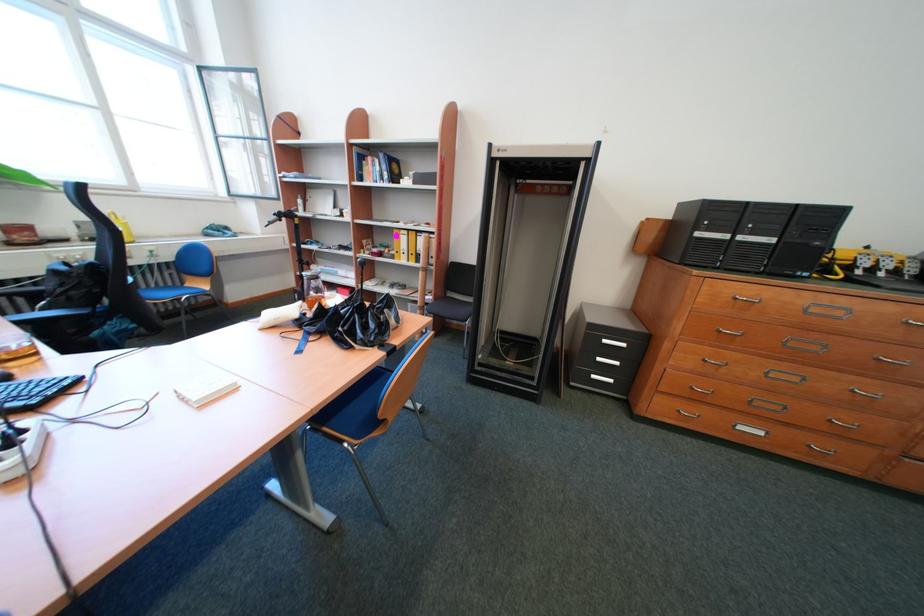
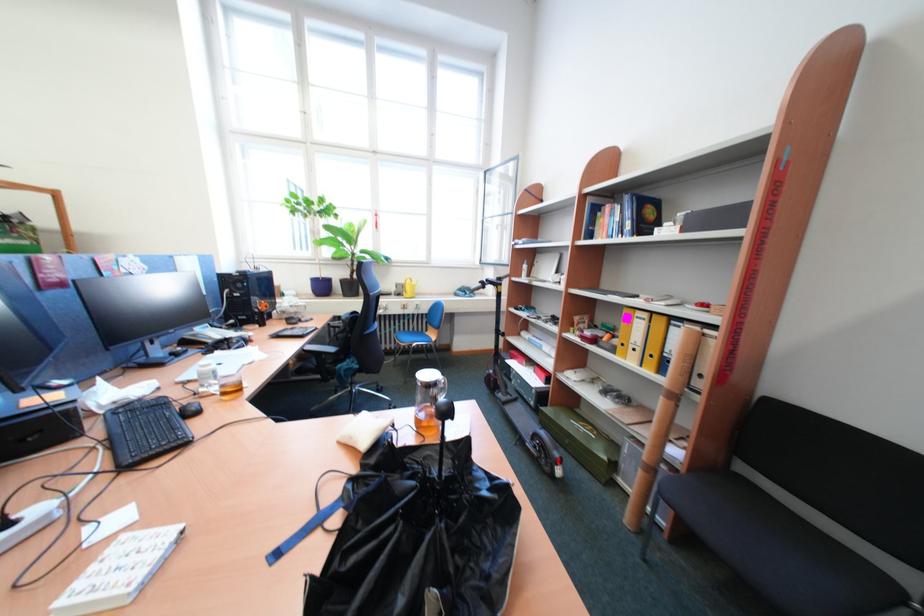
In the second image, find the point that corresponds to pixel 295 205 in the first image.

(523, 270)